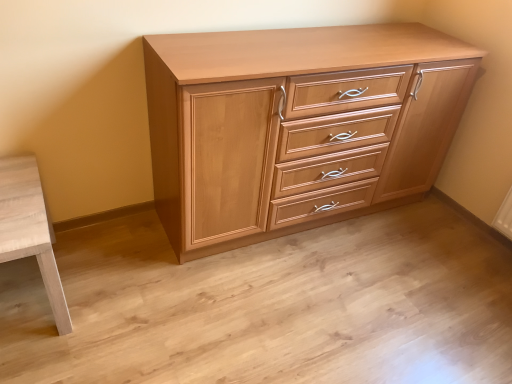
Identify the location of empty space that is to the right of light wood table at lower left. This screenshot has width=512, height=384. (120, 297).